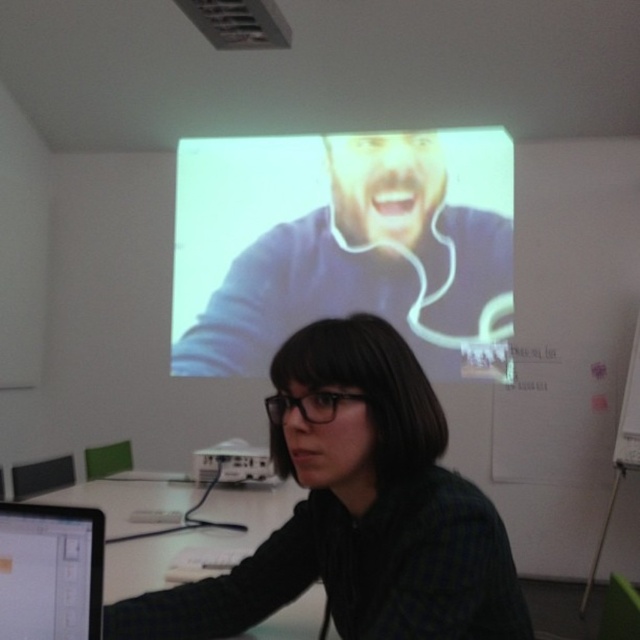
You are a student sitting at the white glossy table at center and want to see the matte black monitor at lower left. Can you see it without moving your chair?

The matte black monitor at lower left is behind the white glossy table at center, so you cannot see it without moving your chair.

You are setting up a classroom for a presentation. You have a matte black monitor at lower left and a white plastic projector at center. Which object has a smaller width?

The matte black monitor at lower left has a lesser width compared to the white plastic projector at center.

You are standing in the classroom and want to see the projection screen clearly. Where should you position yourself relative to the point at coordinates (346,244)?

The white glossy screen at upper center is located at point (346,244). To see it clearly, you should position yourself directly in front of this point to avoid reflections and ensure a clear view.